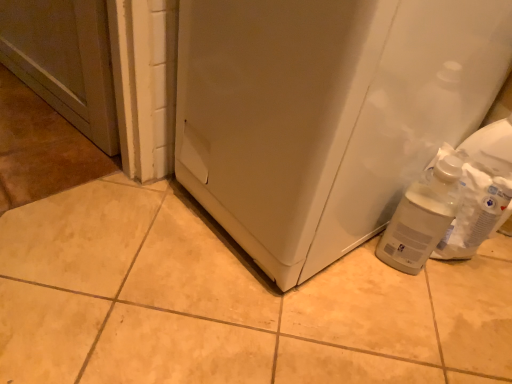
Question: Is white matte refrigerator at lower right to the left of translucent plastic bottle at lower right from the viewer's perspective?

Choices:
 (A) yes
 (B) no

Answer: (A)

Question: Considering the relative sizes of white matte refrigerator at lower right and translucent plastic bottle at lower right in the image provided, is white matte refrigerator at lower right taller than translucent plastic bottle at lower right?

Choices:
 (A) no
 (B) yes

Answer: (B)

Question: Are white matte refrigerator at lower right and translucent plastic bottle at lower right beside each other?

Choices:
 (A) yes
 (B) no

Answer: (B)

Question: Is white matte refrigerator at lower right behind translucent plastic bottle at lower right?

Choices:
 (A) yes
 (B) no

Answer: (B)

Question: Can you confirm if white matte refrigerator at lower right is thinner than translucent plastic bottle at lower right?

Choices:
 (A) no
 (B) yes

Answer: (A)

Question: Considering the relative sizes of white matte refrigerator at lower right and translucent plastic bottle at lower right in the image provided, is white matte refrigerator at lower right bigger than translucent plastic bottle at lower right?

Choices:
 (A) yes
 (B) no

Answer: (A)

Question: Considering the relative sizes of translucent plastic bottle at lower right and white matte refrigerator at lower right in the image provided, is translucent plastic bottle at lower right shorter than white matte refrigerator at lower right?

Choices:
 (A) no
 (B) yes

Answer: (B)

Question: From the image's perspective, is translucent plastic bottle at lower right beneath white matte refrigerator at lower right?

Choices:
 (A) yes
 (B) no

Answer: (A)

Question: Is translucent plastic bottle at lower right surrounding white matte refrigerator at lower right?

Choices:
 (A) no
 (B) yes

Answer: (A)

Question: Considering the relative sizes of translucent plastic bottle at lower right and white matte refrigerator at lower right in the image provided, is translucent plastic bottle at lower right wider than white matte refrigerator at lower right?

Choices:
 (A) no
 (B) yes

Answer: (A)

Question: Considering the relative sizes of translucent plastic bottle at lower right and white matte refrigerator at lower right in the image provided, is translucent plastic bottle at lower right bigger than white matte refrigerator at lower right?

Choices:
 (A) yes
 (B) no

Answer: (B)

Question: Can you confirm if translucent plastic bottle at lower right is thinner than white matte refrigerator at lower right?

Choices:
 (A) yes
 (B) no

Answer: (A)

Question: Looking at the image, does white matte refrigerator at lower right seem bigger or smaller compared to translucent plastic bottle at lower right?

Choices:
 (A) big
 (B) small

Answer: (A)